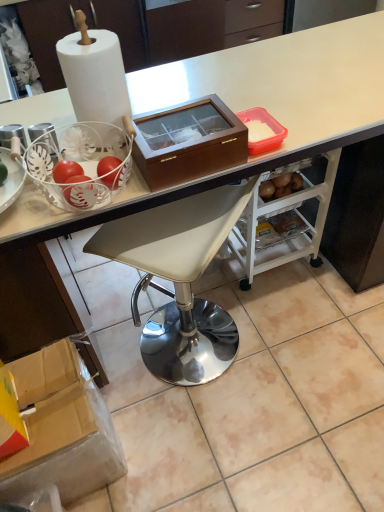
Identify the location of white leather stool at center. This screenshot has height=512, width=384. (179, 280).

Identify the location of white glossy desk at upper center. The height and width of the screenshot is (512, 384). (245, 108).

From the image's perspective, is white leather stool at center above cardboard box at lower left, the first box in the left-to-right sequence?

Indeed, from the image's perspective, white leather stool at center is shown above cardboard box at lower left, the first box in the left-to-right sequence.

Does white leather stool at center come behind cardboard box at lower left, placed as the 2th box when sorted from top to bottom?

No, it is in front of cardboard box at lower left, placed as the 2th box when sorted from top to bottom.

From the picture: Is white leather stool at center oriented away from cardboard box at lower left, placed as the 1th box when sorted from bottom to top?

No, white leather stool at center is not facing the opposite direction of cardboard box at lower left, placed as the 1th box when sorted from bottom to top.

Based on the photo, is white leather stool at center inside the boundaries of cardboard box at lower left, marked as the second box in a right-to-left arrangement, or outside?

white leather stool at center lies outside cardboard box at lower left, marked as the second box in a right-to-left arrangement.

Is white glossy desk at upper center smaller than brown wooden box at center, placed as the first box when sorted from right to left?

No, white glossy desk at upper center is not smaller than brown wooden box at center, placed as the first box when sorted from right to left.

Is white glossy desk at upper center at the left side of brown wooden box at center, acting as the 1th box starting from the top?

In fact, white glossy desk at upper center is to the right of brown wooden box at center, acting as the 1th box starting from the top.

Is white glossy desk at upper center in front of or behind brown wooden box at center, the second box when ordered from left to right, in the image?

white glossy desk at upper center is positioned closer to the viewer than brown wooden box at center, the second box when ordered from left to right.

Is white glossy desk at upper center facing away from brown wooden box at center, acting as the 1th box starting from the top?

No, brown wooden box at center, acting as the 1th box starting from the top, is not at the back of white glossy desk at upper center.

Based on the photo, can you confirm if brown wooden box at center, the second box when ordered from left to right, is wider than white glossy desk at upper center?

No, brown wooden box at center, the second box when ordered from left to right, is not wider than white glossy desk at upper center.

Is brown wooden box at center, the second box when ordered from left to right, bigger or smaller than white glossy desk at upper center?

Considering their sizes, brown wooden box at center, the second box when ordered from left to right, takes up less space than white glossy desk at upper center.

Consider the image. Is brown wooden box at center, placed as the first box when sorted from right to left, taller than white glossy desk at upper center?

No.

From the image's perspective, which one is positioned lower, white glossy desk at upper center or white leather stool at center?

white leather stool at center, from the image's perspective.

Who is smaller, white glossy desk at upper center or white leather stool at center?

white leather stool at center.

Is white glossy desk at upper center positioned beyond the bounds of white leather stool at center?

white glossy desk at upper center lies outside white leather stool at center's area.

What's the angular difference between white glossy desk at upper center and white leather stool at center's facing directions?

128 degrees separate the facing orientations of white glossy desk at upper center and white leather stool at center.

Could you tell me if white leather stool at center is facing brown wooden box at center, acting as the 1th box starting from the top?

No, white leather stool at center is not turned towards brown wooden box at center, acting as the 1th box starting from the top.

Does point (112, 256) appear closer or farther from the camera than point (215, 150)?

Point (112, 256) is farther from the camera than point (215, 150).

You are a GUI agent. You are given a task and a screenshot of the screen. Output one action in this format:
    pyautogui.click(x=<x>, y=<y>)
    Task: Click on the chair located on the left of brown wooden box at center, acting as the 1th box starting from the top
    The image size is (384, 512).
    Given the screenshot: What is the action you would take?
    pyautogui.click(x=179, y=280)

From a real-world perspective, is white leather stool at center on brown wooden box at center, placed as the first box when sorted from right to left?

Actually, white leather stool at center is physically below brown wooden box at center, placed as the first box when sorted from right to left, in the real world.

How many degrees apart are the facing directions of brown wooden box at center, the 2th box ordered from the bottom, and cardboard box at lower left, placed as the 2th box when sorted from top to bottom?

The angle between the facing direction of brown wooden box at center, the 2th box ordered from the bottom, and the facing direction of cardboard box at lower left, placed as the 2th box when sorted from top to bottom, is 1.37 degrees.

Based on the photo, from a real-world perspective, is brown wooden box at center, the second box when ordered from left to right, on cardboard box at lower left, placed as the 2th box when sorted from top to bottom?

Yes, from a real-world perspective, brown wooden box at center, the second box when ordered from left to right, is above cardboard box at lower left, placed as the 2th box when sorted from top to bottom.

Who is smaller, brown wooden box at center, the second box when ordered from left to right, or cardboard box at lower left, placed as the 2th box when sorted from top to bottom?

brown wooden box at center, the second box when ordered from left to right.

How far apart are brown wooden box at center, placed as the first box when sorted from right to left, and cardboard box at lower left, the first box in the left-to-right sequence?

A distance of 26.74 inches exists between brown wooden box at center, placed as the first box when sorted from right to left, and cardboard box at lower left, the first box in the left-to-right sequence.

This screenshot has width=384, height=512. Find the location of `box below the white glossy desk at upper center (from the image's perspective)`. box below the white glossy desk at upper center (from the image's perspective) is located at coordinates (61, 428).

Is white glossy desk at upper center turned away from cardboard box at lower left, placed as the 2th box when sorted from top to bottom?

No, white glossy desk at upper center is not facing the opposite direction of cardboard box at lower left, placed as the 2th box when sorted from top to bottom.

How much distance is there between white glossy desk at upper center and cardboard box at lower left, marked as the second box in a right-to-left arrangement?

white glossy desk at upper center and cardboard box at lower left, marked as the second box in a right-to-left arrangement, are 18.58 inches apart from each other.

Would you say white glossy desk at upper center is a long distance from cardboard box at lower left, the first box in the left-to-right sequence?

No, white glossy desk at upper center is not far from cardboard box at lower left, the first box in the left-to-right sequence.

Identify the location of chair on the right side of cardboard box at lower left, placed as the 2th box when sorted from top to bottom. (179, 280).

In order to click on box that is the 1st object located behind the white glossy desk at upper center in this screenshot , I will do `click(188, 142)`.

Estimate the real-world distances between objects in this image. Which object is closer to cardboard box at lower left, marked as the second box in a right-to-left arrangement, white glossy desk at upper center or white leather stool at center?

Among the two, white glossy desk at upper center is located nearer to cardboard box at lower left, marked as the second box in a right-to-left arrangement.

In the scene shown: From the image, which object appears to be farther from brown wooden box at center, acting as the 1th box starting from the top, cardboard box at lower left, placed as the 1th box when sorted from bottom to top, or white leather stool at center?

Based on the image, white leather stool at center appears to be further to brown wooden box at center, acting as the 1th box starting from the top.

Based on their spatial positions, is white leather stool at center or cardboard box at lower left, placed as the 2th box when sorted from top to bottom, further from brown wooden box at center, the second box when ordered from left to right?

white leather stool at center.

Based on their spatial positions, is cardboard box at lower left, marked as the second box in a right-to-left arrangement, or brown wooden box at center, acting as the 1th box starting from the top, closer to white leather stool at center?

The object closer to white leather stool at center is cardboard box at lower left, marked as the second box in a right-to-left arrangement.

Based on their spatial positions, is brown wooden box at center, placed as the first box when sorted from right to left, or white glossy desk at upper center further from cardboard box at lower left, marked as the second box in a right-to-left arrangement?

brown wooden box at center, placed as the first box when sorted from right to left.

Which object lies further to the anchor point white leather stool at center, brown wooden box at center, the 2th box ordered from the bottom, or white glossy desk at upper center?

brown wooden box at center, the 2th box ordered from the bottom.

From the image, which object appears to be farther from brown wooden box at center, placed as the first box when sorted from right to left, white glossy desk at upper center or cardboard box at lower left, placed as the 1th box when sorted from bottom to top?

cardboard box at lower left, placed as the 1th box when sorted from bottom to top, is positioned further to the anchor brown wooden box at center, placed as the first box when sorted from right to left.

From the picture: Estimate the real-world distances between objects in this image. Which object is closer to white glossy desk at upper center, brown wooden box at center, the 2th box ordered from the bottom, or cardboard box at lower left, placed as the 2th box when sorted from top to bottom?

brown wooden box at center, the 2th box ordered from the bottom, lies closer to white glossy desk at upper center than the other object.

Locate an element on the screen. The width and height of the screenshot is (384, 512). chair between white glossy desk at upper center and cardboard box at lower left, the first box in the left-to-right sequence, vertically is located at coordinates (179, 280).

Locate an element on the screen. The height and width of the screenshot is (512, 384). desk between brown wooden box at center, the 2th box ordered from the bottom, and cardboard box at lower left, placed as the 1th box when sorted from bottom to top, vertically is located at coordinates (245, 108).

The height and width of the screenshot is (512, 384). In order to click on chair that lies between brown wooden box at center, the 2th box ordered from the bottom, and cardboard box at lower left, marked as the second box in a right-to-left arrangement, from top to bottom in this screenshot , I will do `click(179, 280)`.

What are the coordinates of `desk between brown wooden box at center, placed as the first box when sorted from right to left, and white leather stool at center vertically` in the screenshot? It's located at (245, 108).